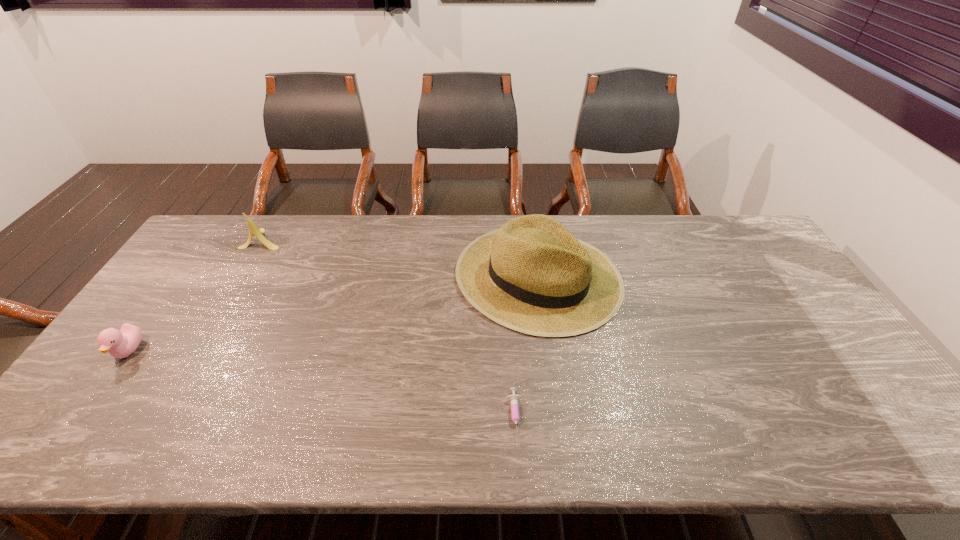
At what (x,y) coordinates should I click in order to perform the action: click on sunhat. Please return your answer as a coordinate pair (x, y). Image resolution: width=960 pixels, height=540 pixels. Looking at the image, I should click on (532, 275).

This screenshot has height=540, width=960. I want to click on banana, so click(253, 229).

Find the location of a particular element. This screenshot has width=960, height=540. the second object from left to right is located at coordinates (253, 229).

You are a GUI agent. You are given a task and a screenshot of the screen. Output one action in this format:
    pyautogui.click(x=<x>, y=<y>)
    Task: Click on the third tallest object
    This screenshot has height=540, width=960.
    Given the screenshot: What is the action you would take?
    pyautogui.click(x=121, y=343)

At what (x,y) coordinates should I click in order to perform the action: click on duckling. Please return your answer as a coordinate pair (x, y). The width and height of the screenshot is (960, 540). Looking at the image, I should click on (121, 343).

Locate an element on the screen. The image size is (960, 540). the nearest object is located at coordinates (514, 399).

Identify the location of syringe. (514, 399).

Where is `vacant space located on the left of the sunhat`? The image size is (960, 540). vacant space located on the left of the sunhat is located at coordinates (420, 277).

Locate an element on the screen. The height and width of the screenshot is (540, 960). free space located on the back of the second object from left to right is located at coordinates pos(274,219).

Find the location of `free space located on the front-facing side of the duckling`. free space located on the front-facing side of the duckling is located at coordinates (78, 421).